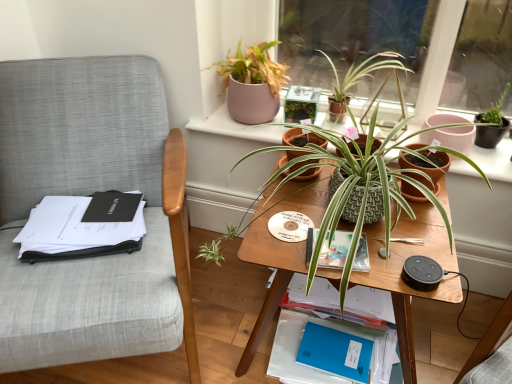
Find the location of a particular element. vacant space situated on the left part of blue matte notebook at lower center is located at coordinates (239, 321).